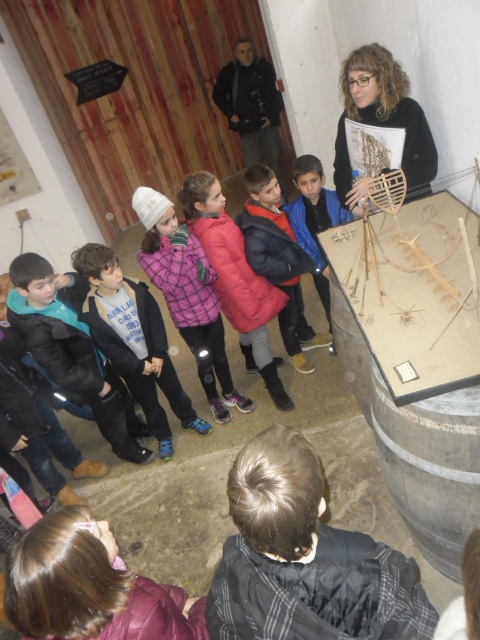
You are a photographer setting up for a group photo of the children and the teacher. You need to ensure that both the black fuzzy jacket at lower center and the teal fleece jacket at lower left are clearly visible in the frame. Which jacket will require more space to accommodate in the photo composition?

The teal fleece jacket at lower left requires more space because it occupies more space than the black fuzzy jacket at lower center.